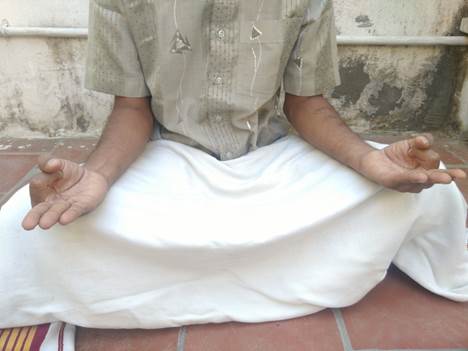
Find the location of a particular element. The height and width of the screenshot is (351, 468). red tiled floor is located at coordinates (392, 331).